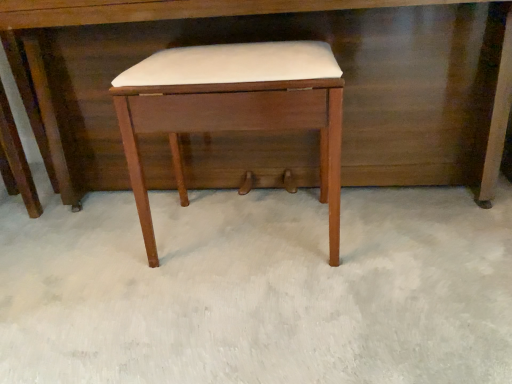
Describe the element at coordinates (167, 10) in the screenshot. I see `wooden desk at center` at that location.

Where is `wooden desk at center`? wooden desk at center is located at coordinates (167, 10).

This screenshot has height=384, width=512. I want to click on white leather stool at center, so click(233, 108).

The height and width of the screenshot is (384, 512). What do you see at coordinates (233, 108) in the screenshot?
I see `white leather stool at center` at bounding box center [233, 108].

I want to click on wooden desk at center, so click(167, 10).

Can you confirm if white leather stool at center is positioned to the right of wooden desk at center?

In fact, white leather stool at center is to the left of wooden desk at center.

In the image, is white leather stool at center positioned in front of or behind wooden desk at center?

Clearly, white leather stool at center is in front of wooden desk at center.

Considering the positions of points (147, 253) and (113, 14), is point (147, 253) farther from camera compared to point (113, 14)?

Yes, point (147, 253) is behind point (113, 14).

Consider the image. From the image's perspective, which is below, white leather stool at center or wooden desk at center?

white leather stool at center appears lower in the image.

From a real-world perspective, is white leather stool at center physically above wooden desk at center?

No.

Which of these two, white leather stool at center or wooden desk at center, is thinner?

With smaller width is white leather stool at center.

Can you confirm if white leather stool at center is shorter than wooden desk at center?

Indeed, white leather stool at center has a lesser height compared to wooden desk at center.

Who is bigger, white leather stool at center or wooden desk at center?

Bigger between the two is wooden desk at center.

Could wooden desk at center be considered to be inside white leather stool at center?

No, wooden desk at center is not inside white leather stool at center.

Is white leather stool at center far away from wooden desk at center?

No, white leather stool at center is not far from wooden desk at center.

Is white leather stool at center oriented towards wooden desk at center?

Yes, white leather stool at center is aimed at wooden desk at center.

How distant is white leather stool at center from wooden desk at center?

The distance of white leather stool at center from wooden desk at center is 8.81 inches.

This screenshot has width=512, height=384. In the image, there is a white leather stool at center. Find the location of `desk above it (from the image's perspective)`. desk above it (from the image's perspective) is located at coordinates (167, 10).

Considering the relative positions of wooden desk at center and white leather stool at center in the image provided, is wooden desk at center to the left of white leather stool at center from the viewer's perspective?

In fact, wooden desk at center is to the right of white leather stool at center.

Is wooden desk at center further to camera compared to white leather stool at center?

Yes.

Which is in front, point (79, 13) or point (134, 192)?

The point (79, 13) is in front.

From the image's perspective, which one is positioned lower, wooden desk at center or white leather stool at center?

white leather stool at center, from the image's perspective.

From a real-world perspective, is wooden desk at center positioned under white leather stool at center based on gravity?

Actually, wooden desk at center is physically above white leather stool at center in the real world.

Does wooden desk at center have a lesser width compared to white leather stool at center?

No, wooden desk at center is not thinner than white leather stool at center.

Between wooden desk at center and white leather stool at center, which one has less height?

white leather stool at center.

Can you confirm if wooden desk at center is bigger than white leather stool at center?

Yes, wooden desk at center is bigger than white leather stool at center.

Is wooden desk at center not inside white leather stool at center?

Yes, wooden desk at center is outside of white leather stool at center.

Are wooden desk at center and white leather stool at center making contact?

No, wooden desk at center is not touching white leather stool at center.

Is wooden desk at center positioned with its back to white leather stool at center?

Yes.

Based on the photo, how many degrees apart are the facing directions of wooden desk at center and white leather stool at center?

The facing directions of wooden desk at center and white leather stool at center are 0.573 degrees apart.

Measure the distance from wooden desk at center to white leather stool at center.

wooden desk at center is 8.81 inches away from white leather stool at center.

This screenshot has height=384, width=512. Identify the location of desk behind the white leather stool at center. (167, 10).

In the image, there is a wooden desk at center. Where is `stool below it (from a real-world perspective)`? This screenshot has width=512, height=384. stool below it (from a real-world perspective) is located at coordinates 233,108.

Where is `desk above the white leather stool at center (from the image's perspective)`? Image resolution: width=512 pixels, height=384 pixels. desk above the white leather stool at center (from the image's perspective) is located at coordinates (167, 10).